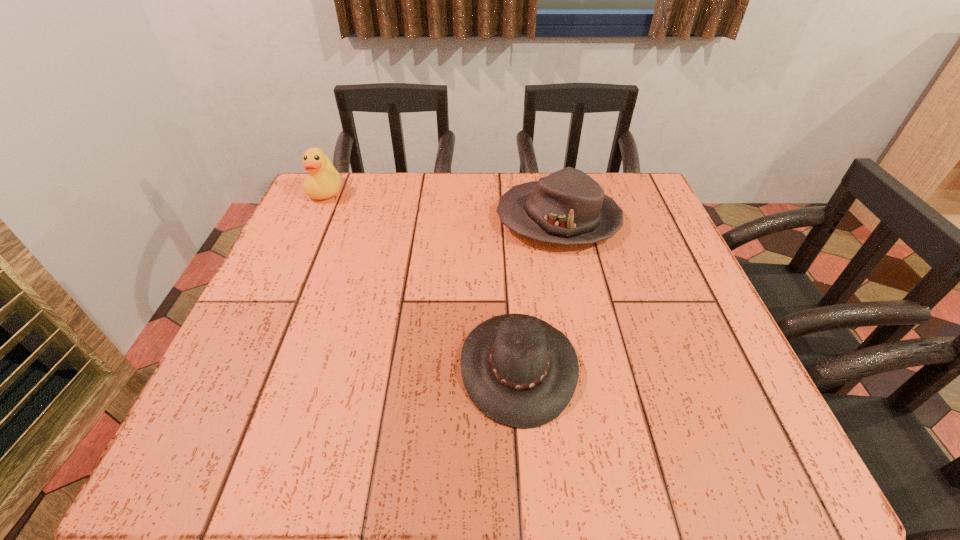
At what (x,y) coordinates should I click in order to perform the action: click on vacant space at the near edge of the desktop. Please return your answer as a coordinate pair (x, y). Looking at the image, I should click on (553, 454).

In the image, there is a desktop. Where is `vacant space at the left edge`? The width and height of the screenshot is (960, 540). vacant space at the left edge is located at coordinates (254, 358).

At what (x,y) coordinates should I click in order to perform the action: click on free region at the right edge of the desktop. Please return your answer as a coordinate pair (x, y). The image size is (960, 540). Looking at the image, I should click on (720, 354).

Locate an element on the screen. The height and width of the screenshot is (540, 960). free point at the far left corner is located at coordinates (369, 196).

In the image, there is a desktop. Identify the location of vacant space at the far right corner. The image size is (960, 540). (598, 176).

Locate an element on the screen. free space between the second tallest object and the shortest object is located at coordinates (539, 293).

You are a GUI agent. You are given a task and a screenshot of the screen. Output one action in this format:
    pyautogui.click(x=<x>, y=<y>)
    Task: Click on the vacant area between the duck and the second tallest object
    The height and width of the screenshot is (540, 960).
    Given the screenshot: What is the action you would take?
    pyautogui.click(x=443, y=206)

Identify the location of free spot between the farther hat and the leftmost object. This screenshot has width=960, height=540. (443, 206).

The height and width of the screenshot is (540, 960). Find the location of `free spot between the shortest object and the leftmost object`. free spot between the shortest object and the leftmost object is located at coordinates (422, 279).

I want to click on free space between the second tallest object and the nearest object, so click(x=539, y=293).